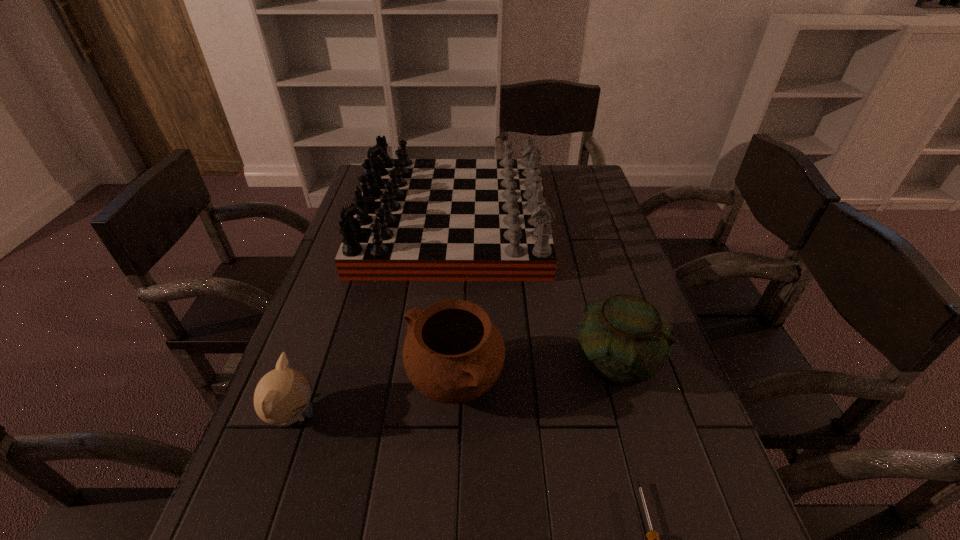
I want to click on gameboard, so click(x=416, y=219).

Where is `the left pottery`? This screenshot has height=540, width=960. the left pottery is located at coordinates (453, 353).

Where is `the right pottery`? The height and width of the screenshot is (540, 960). the right pottery is located at coordinates (624, 340).

At what (x,y) coordinates should I click in order to perform the action: click on the fourth tallest object. Please return your answer as a coordinate pair (x, y). The width and height of the screenshot is (960, 540). Looking at the image, I should click on (282, 396).

You are a GUI agent. You are given a task and a screenshot of the screen. Output one action in this format:
    pyautogui.click(x=<x>, y=<y>)
    Task: Click on the vacant space located 0.150m on the front of the gameboard
    
    Given the screenshot: What is the action you would take?
    pyautogui.click(x=444, y=322)

Identify the location of vacant position located 0.090m on the left of the left pottery. (365, 383).

At what (x,y) coordinates should I click in order to perform the action: click on vacant area situated on the left of the right pottery. Please return your answer as a coordinate pair (x, y). The height and width of the screenshot is (540, 960). Looking at the image, I should click on (454, 362).

This screenshot has height=540, width=960. What are the coordinates of `free spot located 0.170m on the face of the kitten` in the screenshot? It's located at (403, 416).

In order to click on object that is at the far edge in this screenshot , I will do `click(416, 219)`.

You are a GUI agent. You are given a task and a screenshot of the screen. Output one action in this format:
    pyautogui.click(x=<x>, y=<y>)
    Task: Click on the gameboard that is at the left edge
    Image resolution: width=960 pixels, height=540 pixels.
    Given the screenshot: What is the action you would take?
    pyautogui.click(x=416, y=219)